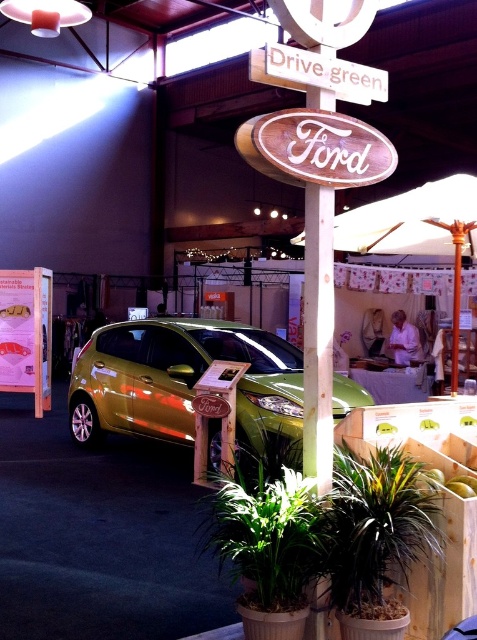
Can you confirm if green leafy plant at lower center is positioned to the right of white fabric umbrella at upper center?

No, green leafy plant at lower center is not to the right of white fabric umbrella at upper center.

How far apart are green leafy plant at lower center and white fabric umbrella at upper center?

green leafy plant at lower center is 5.05 feet from white fabric umbrella at upper center.

Who is more distant from viewer, [383,508] or [441,243]?

Point [441,243]

Image resolution: width=477 pixels, height=640 pixels. In order to click on green leafy plant at lower center in this screenshot , I will do `click(375, 529)`.

Is green leafy plant at center bigger than white fabric umbrella at upper center?

No.

Between green leafy plant at center and white fabric umbrella at upper center, which one has less height?

Standing shorter between the two is green leafy plant at center.

Between point (268, 579) and point (414, 227), which one is positioned in front?

Point (268, 579) is more forward.

At what (x,y) coordinates should I click in order to perform the action: click on green leafy plant at center. Please return your answer as a coordinate pair (x, y). Looking at the image, I should click on (269, 534).

Image resolution: width=477 pixels, height=640 pixels. What do you see at coordinates (186, 385) in the screenshot?
I see `metallic gold car at center` at bounding box center [186, 385].

From the picture: Between metallic gold car at center and white fabric umbrella at upper center, which one is positioned lower?

metallic gold car at center is lower down.

Who is more forward, (167, 426) or (364, 221)?

Point (364, 221)

This screenshot has height=640, width=477. I want to click on metallic gold car at center, so click(186, 385).